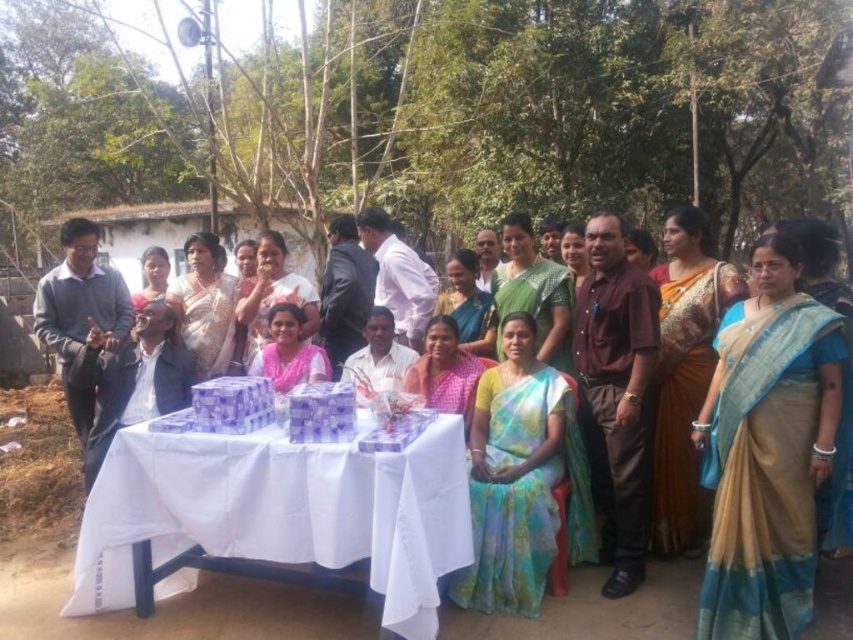
Which is behind, point (209, 499) or point (299, 374)?

The point (299, 374) is more distant.

Is point (241, 506) closer to camera compared to point (318, 353)?

Yes, it is.

Locate an element on the screen. white paper table at center is located at coordinates (282, 512).

Does point (152, 262) come in front of point (631, 260)?

No, it is not.

Between point (158, 291) and point (636, 248), which one is positioned in front?

Point (636, 248)

Which is behind, point (136, 300) or point (653, 248)?

The point (136, 300) is behind.

I want to click on matte pink saree at center, so click(x=151, y=276).

Does white paper table at center have a larger size compared to yellow-green silk saree at center?

Yes, white paper table at center is bigger than yellow-green silk saree at center.

Which of these two, white paper table at center or yellow-green silk saree at center, stands shorter?

Standing shorter between the two is white paper table at center.

Identify the location of white paper table at center. Image resolution: width=853 pixels, height=640 pixels. (282, 512).